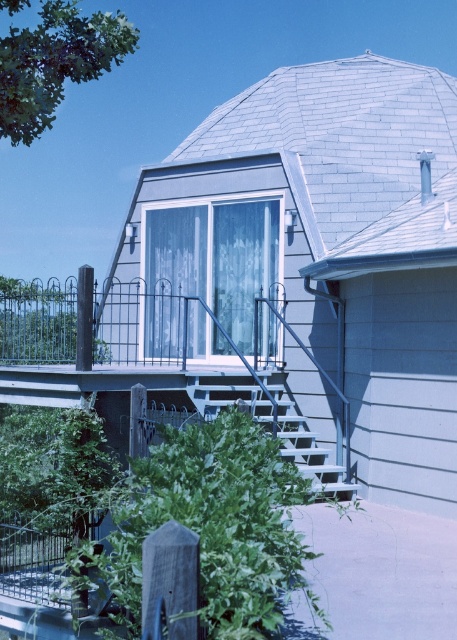
Question: Considering the relative positions of metallic gray porch at center and white matte stairs at lower center in the image provided, where is metallic gray porch at center located with respect to white matte stairs at lower center?

Choices:
 (A) right
 (B) left

Answer: (A)

Question: Can you confirm if metallic gray porch at center is positioned to the right of white matte stairs at lower center?

Choices:
 (A) no
 (B) yes

Answer: (B)

Question: Among these points, which one is nearest to the camera?

Choices:
 (A) (262, 292)
 (B) (302, 444)

Answer: (B)

Question: Among these objects, which one is farthest from the camera?

Choices:
 (A) metallic gray porch at center
 (B) white matte stairs at lower center

Answer: (A)

Question: Does metallic gray porch at center appear on the right side of white matte stairs at lower center?

Choices:
 (A) yes
 (B) no

Answer: (A)

Question: Among these points, which one is farthest from the camera?

Choices:
 (A) pyautogui.click(x=198, y=336)
 (B) pyautogui.click(x=197, y=387)

Answer: (A)